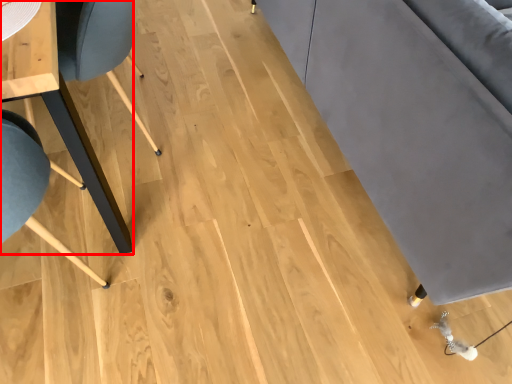
Question: Considering the relative positions of table (annotated by the red box) and couch in the image provided, where is table (annotated by the red box) located with respect to the staircase?

Choices:
 (A) right
 (B) left

Answer: (B)